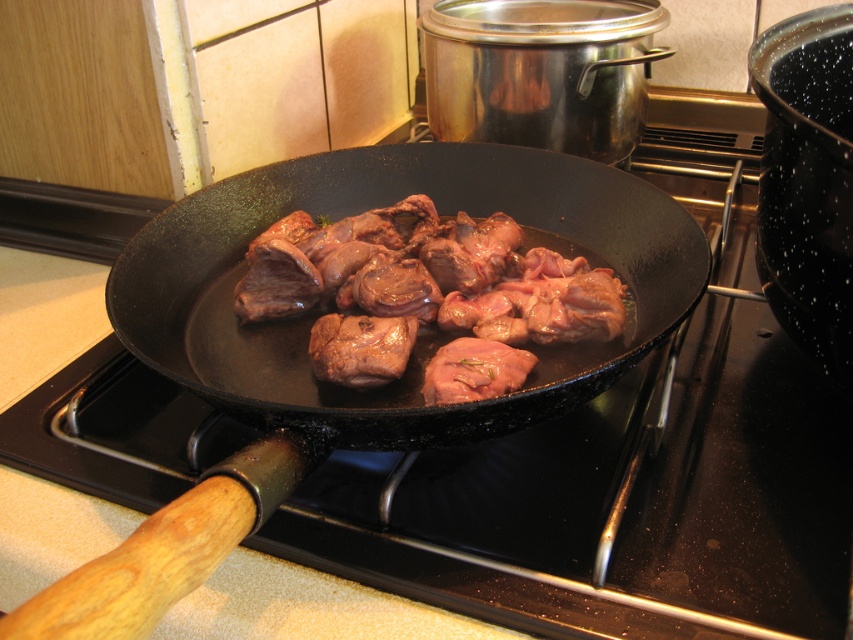
Who is positioned more to the left, black matte wok at center or brown glossy meat at center?

Positioned to the left is black matte wok at center.

Is black matte wok at center positioned at the back of brown glossy meat at center?

No, it is not.

Is point (224, 189) farther from camera compared to point (485, 288)?

Yes, it is.

Where is `black matte wok at center`? The image size is (853, 640). black matte wok at center is located at coordinates (421, 346).